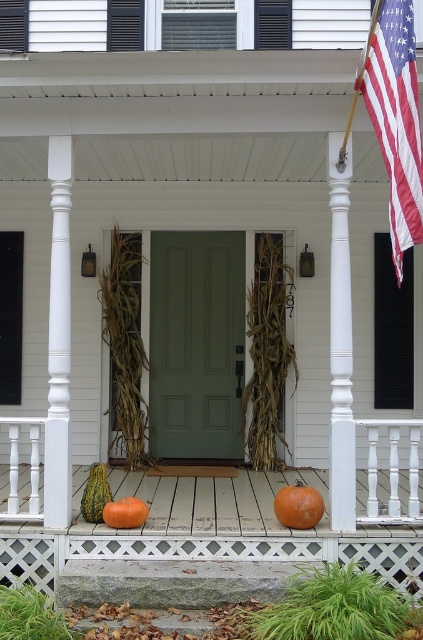
Is point (415, 230) behind point (96, 472)?

That is False.

Does american flag at upper right come behind green matte gourd at lower left?

No, american flag at upper right is closer to the viewer.

Locate an element on the screen. This screenshot has width=423, height=640. american flag at upper right is located at coordinates (395, 116).

Find the location of a particular element. Image resolution: width=423 pixels, height=640 pixels. american flag at upper right is located at coordinates (395, 116).

Between white painted wood post at center and orange matte pumpkin at lower center, which one is positioned higher?

Positioned higher is white painted wood post at center.

Can you confirm if white painted wood post at center is positioned to the left of orange matte pumpkin at lower center?

In fact, white painted wood post at center is to the right of orange matte pumpkin at lower center.

Between point (335, 346) and point (301, 512), which one is positioned behind?

Positioned behind is point (335, 346).

Find the location of `white painted wood post at center`. white painted wood post at center is located at coordinates (340, 342).

Who is more forward, (x=294, y=484) or (x=118, y=500)?

Point (x=294, y=484)

Is orange matte pumpkin at lower center to the right of orange matte pumpkin at center from the viewer's perspective?

Yes, orange matte pumpkin at lower center is to the right of orange matte pumpkin at center.

Image resolution: width=423 pixels, height=640 pixels. Find the location of `orange matte pumpkin at lower center`. orange matte pumpkin at lower center is located at coordinates (299, 506).